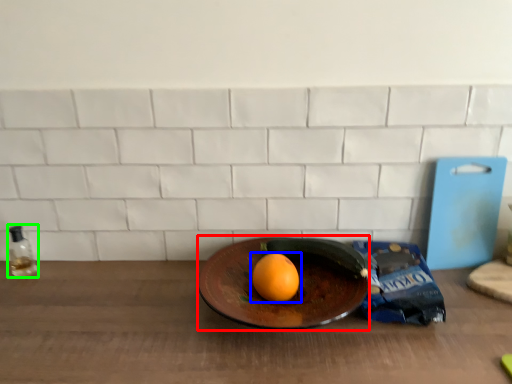
Question: Which is nearer to the plate (highlighted by a red box)? grapefruit (highlighted by a blue box) or bottle (highlighted by a green box).

Choices:
 (A) grapefruit
 (B) bottle

Answer: (A)